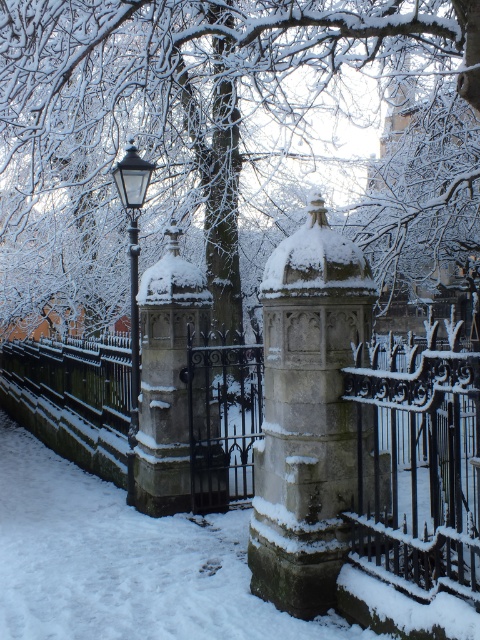
Does stone textured fence at center have a larger size compared to polished brass lamp post at upper left?

Correct, stone textured fence at center is larger in size than polished brass lamp post at upper left.

Is stone textured fence at center to the right of polished brass lamp post at upper left from the viewer's perspective?

Yes, stone textured fence at center is to the right of polished brass lamp post at upper left.

The image size is (480, 640). In order to click on stone textured fence at center in this screenshot , I will do `click(419, 461)`.